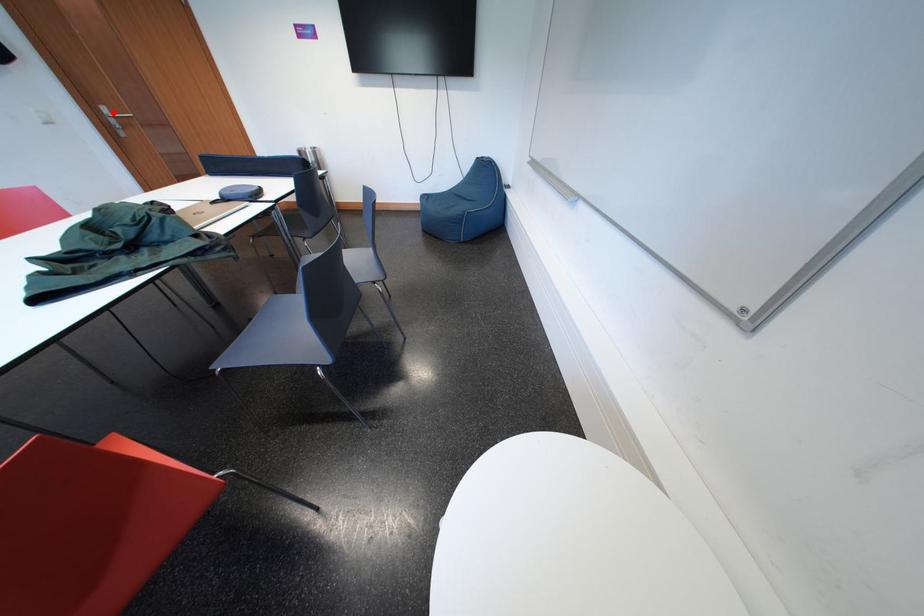
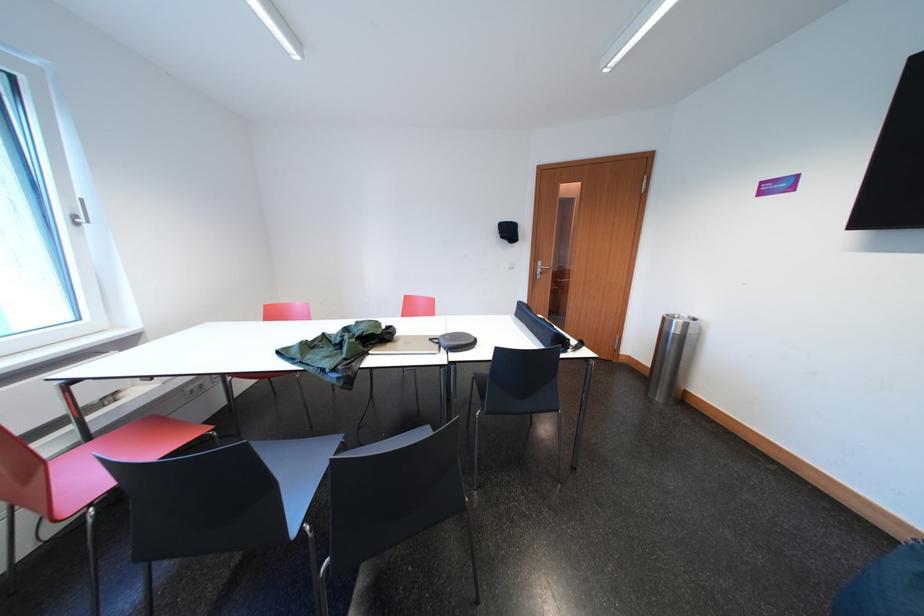
In the second image, find the point that corresponds to the highlighted location in the first image.

(550, 268)